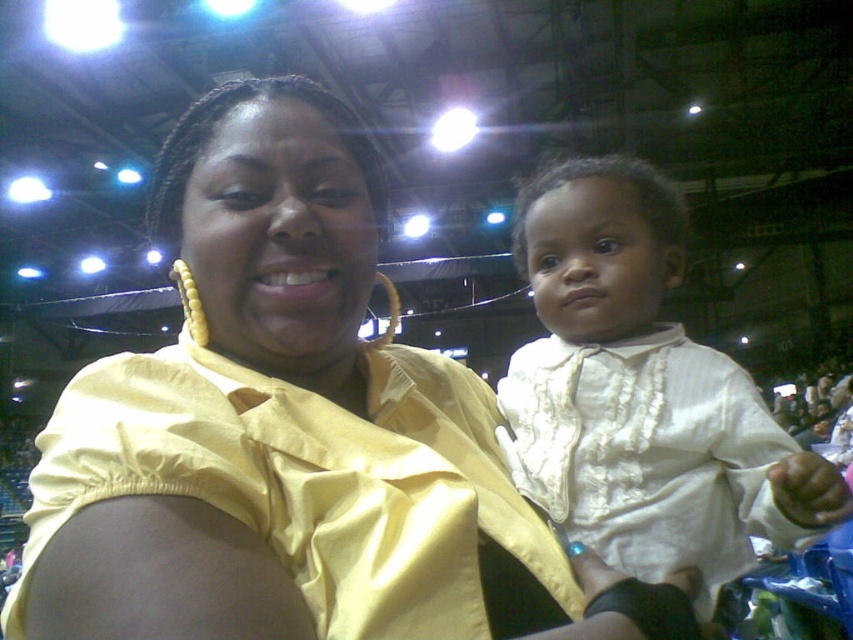
Question: Which point is farther to the camera?

Choices:
 (A) yellow satin shirt at center
 (B) white satin shirt at center

Answer: (B)

Question: Which object appears farthest from the camera in this image?

Choices:
 (A) white satin shirt at center
 (B) yellow satin shirt at center

Answer: (A)

Question: Which point is farther from the camera taking this photo?

Choices:
 (A) (634, 410)
 (B) (236, 428)

Answer: (A)

Question: Is yellow satin shirt at center to the left of white satin shirt at center from the viewer's perspective?

Choices:
 (A) yes
 (B) no

Answer: (A)

Question: Can you confirm if yellow satin shirt at center is wider than white satin shirt at center?

Choices:
 (A) yes
 (B) no

Answer: (A)

Question: Is yellow satin shirt at center behind white satin shirt at center?

Choices:
 (A) no
 (B) yes

Answer: (A)